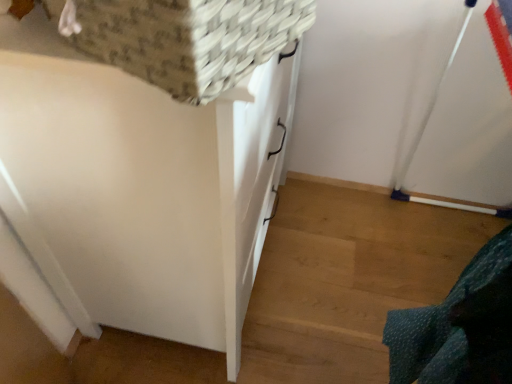
The width and height of the screenshot is (512, 384). What do you see at coordinates (139, 190) in the screenshot?
I see `white matte cabinet at center` at bounding box center [139, 190].

You are a GUI agent. You are given a task and a screenshot of the screen. Output one action in this format:
    pyautogui.click(x=<x>, y=<y>)
    Task: Click on the white matte cabinet at center
    Image resolution: width=512 pixels, height=384 pixels.
    Given the screenshot: What is the action you would take?
    pyautogui.click(x=139, y=190)

What is the approximate width of white matte cabinet at center?

white matte cabinet at center is 21.82 inches wide.

In order to face white matte cabinet at center, should I rotate leftwards or rightwards?

To align with it, rotate left about 9.154°.

Identify the location of white matte cabinet at center. This screenshot has height=384, width=512. (139, 190).